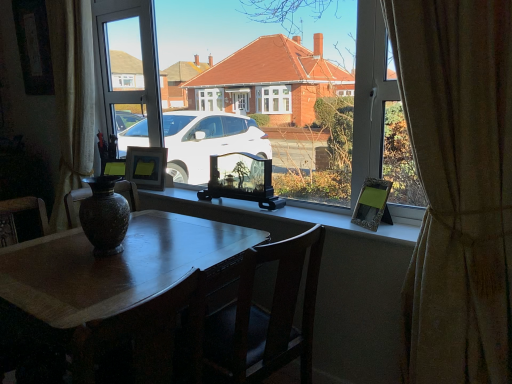
Where is `matte black vase at lower left`? This screenshot has width=512, height=384. matte black vase at lower left is located at coordinates (29, 360).

The height and width of the screenshot is (384, 512). Identify the location of marbled stone vase at center. (104, 216).

What do you see at coordinates (113, 266) in the screenshot? I see `shiny dark wood table at center` at bounding box center [113, 266].

What is the approximate width of translucent glass picture frame at center, the 2th picture frame positioned from the right?

It is 4.96 inches.

At what (x,y) coordinates should I click in order to perform the action: click on beige textured curtain at right. Please return your answer as a coordinate pair (x, y). Looking at the image, I should click on (458, 187).

Identify the location of transparent glass window at center. (306, 110).

From a real-world perspective, does wooden chair at center sit lower than translucent glass picture frame at center, placed as the 2th picture frame when sorted from left to right?

Yes, from a real-world perspective, wooden chair at center is under translucent glass picture frame at center, placed as the 2th picture frame when sorted from left to right.

I want to click on chair that is on the right side of translucent glass picture frame at center, positioned as the second picture frame in front-to-back order, so [x=263, y=317].

From the image's perspective, is wooden chair at center located above or below translucent glass picture frame at center, positioned as the 2th picture frame in back-to-front order?

Clearly, from the image's perspective, wooden chair at center is below translucent glass picture frame at center, positioned as the 2th picture frame in back-to-front order.

How different are the orientations of wooden chair at center and translucent glass picture frame at center, positioned as the 2th picture frame in back-to-front order, in degrees?

They differ by 97.4 degrees in their facing directions.

Which is behind, matte black picture frame at center, which appears as the first picture frame when viewed from the back, or matte black vase at lower left?

matte black picture frame at center, which appears as the first picture frame when viewed from the back, is further away from the camera.

In the scene shown: From the image's perspective, relative to matte black vase at lower left, is matte black picture frame at center, which appears as the first picture frame when viewed from the back, above or below?

From the image's perspective, matte black picture frame at center, which appears as the first picture frame when viewed from the back, appears above matte black vase at lower left.

From a real-world perspective, is matte black picture frame at center, placed as the first picture frame when sorted from left to right, beneath matte black vase at lower left?

No, from a real-world perspective, matte black picture frame at center, placed as the first picture frame when sorted from left to right, is not below matte black vase at lower left.

Who is smaller, shiny dark wood table at center or marbled stone vase at center?

marbled stone vase at center is smaller.

Is shiny dark wood table at center in contact with marbled stone vase at center?

shiny dark wood table at center and marbled stone vase at center are clearly separated.

Is point (60, 279) positioned behind point (97, 234)?

No, it is not.

From a real-world perspective, which object stands above the other?

In real-world perspective, marbled stone vase at center is above.

Consider the image. Can you confirm if matte black picture frame at center, placed as the first picture frame when sorted from left to right, is smaller than shiny dark wood table at center?

Yes.

Is matte black picture frame at center, which is the 3th picture frame in right-to-left order, not close to shiny dark wood table at center?

No, matte black picture frame at center, which is the 3th picture frame in right-to-left order, is not far away from shiny dark wood table at center.

Which object is more forward, matte black picture frame at center, placed as the first picture frame when sorted from left to right, or shiny dark wood table at center?

Positioned in front is shiny dark wood table at center.

Measure the distance from matte black vase at lower left to metallic silver picture frame at right, the 1th picture frame in the right-to-left sequence.

6.92 feet.

Does matte black vase at lower left have a larger size compared to metallic silver picture frame at right, which appears as the 3th picture frame when viewed from the back?

Correct, matte black vase at lower left is larger in size than metallic silver picture frame at right, which appears as the 3th picture frame when viewed from the back.

Can we say matte black vase at lower left lies outside metallic silver picture frame at right, the 1th picture frame in the right-to-left sequence?

Yes, matte black vase at lower left is outside of metallic silver picture frame at right, the 1th picture frame in the right-to-left sequence.

Can you confirm if matte black vase at lower left is shorter than metallic silver picture frame at right, arranged as the third picture frame when viewed from the left?

Incorrect, the height of matte black vase at lower left does not fall short of that of metallic silver picture frame at right, arranged as the third picture frame when viewed from the left.

From a real-world perspective, is marbled stone vase at center physically above transparent glass window at center?

No, from a real-world perspective, marbled stone vase at center is not on top of transparent glass window at center.

Between point (120, 208) and point (248, 118), which one is positioned in front?

The point (120, 208) is more forward.

Is transparent glass window at center a part of marbled stone vase at center?

That's incorrect, transparent glass window at center is not inside marbled stone vase at center.

How different are the orientations of marbled stone vase at center and transparent glass window at center in degrees?

The angle between the facing direction of marbled stone vase at center and the facing direction of transparent glass window at center is 0.743 degrees.

Is matte black vase at lower left closer to the viewer compared to shiny dark wood table at center?

That is False.

From the image's perspective, is matte black vase at lower left below shiny dark wood table at center?

No, from the image's perspective, matte black vase at lower left is not beneath shiny dark wood table at center.

Locate an element on the screen. The width and height of the screenshot is (512, 384). table on the right of matte black vase at lower left is located at coordinates (113, 266).

Are matte black vase at lower left and shiny dark wood table at center far apart?

Yes, matte black vase at lower left and shiny dark wood table at center are quite far apart.

The height and width of the screenshot is (384, 512). What are the coordinates of `chair lying on the right of translucent glass picture frame at center, placed as the 2th picture frame when sorted from left to right` in the screenshot? It's located at (263, 317).

Locate an element on the screen. The width and height of the screenshot is (512, 384). armchair lying below the matte black picture frame at center, which appears as the first picture frame when viewed from the back (from the image's perspective) is located at coordinates (29, 360).

Based on their spatial positions, is matte black vase at lower left or transparent glass window at center closer to metallic silver picture frame at right, the 1th picture frame in the right-to-left sequence?

Based on the image, transparent glass window at center appears to be nearer to metallic silver picture frame at right, the 1th picture frame in the right-to-left sequence.

Considering their positions, is matte black vase at lower left positioned further to matte glass photo frame at center than matte black picture frame at center, placed as the first picture frame when sorted from left to right?

Based on the image, matte black vase at lower left appears to be further to matte glass photo frame at center.

Estimate the real-world distances between objects in this image. Which object is closer to metallic silver picture frame at right, arranged as the third picture frame when viewed from the left, matte black picture frame at center, placed as the first picture frame when sorted from left to right, or shiny dark wood table at center?

shiny dark wood table at center.

From the image, which object appears to be nearer to marbled stone vase at center, wooden chair at center or matte black picture frame at center, which is the 3th picture frame in right-to-left order?

Based on the image, wooden chair at center appears to be nearer to marbled stone vase at center.

Looking at the image, which one is located closer to shiny dark wood table at center, beige textured curtain at right or wooden chair at center?

wooden chair at center lies closer to shiny dark wood table at center than the other object.

Looking at the image, which one is located closer to matte black vase at lower left, metallic silver picture frame at right, which appears as the 3th picture frame when viewed from the back, or shiny dark wood table at center?

shiny dark wood table at center is closer to matte black vase at lower left.

Based on the photo, based on their spatial positions, is metallic silver picture frame at right, acting as the 1th picture frame starting from the front, or shiny dark wood table at center closer to wooden chair at center?

shiny dark wood table at center.

From the image, which object appears to be nearer to matte black picture frame at center, which is the 3th picture frame in right-to-left order, transparent glass window at center or marbled stone vase at center?

transparent glass window at center lies closer to matte black picture frame at center, which is the 3th picture frame in right-to-left order, than the other object.

Identify the location of chair located between beige textured curtain at right and translucent glass picture frame at center, placed as the 2th picture frame when sorted from left to right, in the depth direction. The height and width of the screenshot is (384, 512). (263, 317).

This screenshot has height=384, width=512. What are the coordinates of `chair between shiny dark wood table at center and beige textured curtain at right` in the screenshot? It's located at (263, 317).

Where is `window sill situated between matte black vase at lower left and beige textured curtain at right from left to right`? window sill situated between matte black vase at lower left and beige textured curtain at right from left to right is located at coordinates (343, 219).

In order to click on chair between beige textured curtain at right and matte glass photo frame at center from front to back in this screenshot , I will do `click(263, 317)`.